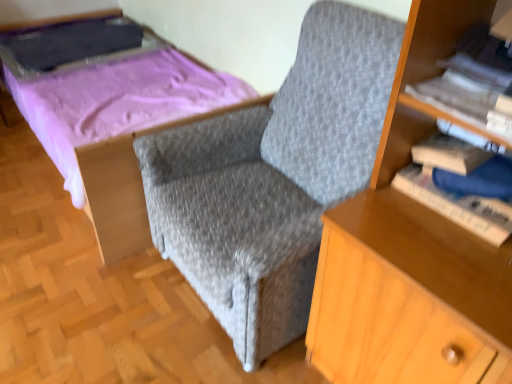
Question: Considering the relative sizes of matte purple bed at upper left and hardcover book at right, which ranks as the 2th book in top-to-bottom order, in the image provided, is matte purple bed at upper left shorter than hardcover book at right, which ranks as the 2th book in top-to-bottom order,?

Choices:
 (A) no
 (B) yes

Answer: (A)

Question: From the image's perspective, does matte purple bed at upper left appear higher than hardcover book at right, which ranks as the 2th book in top-to-bottom order?

Choices:
 (A) yes
 (B) no

Answer: (A)

Question: Is matte purple bed at upper left in front of hardcover book at right, which ranks as the 2th book in top-to-bottom order?

Choices:
 (A) no
 (B) yes

Answer: (A)

Question: Would you say matte purple bed at upper left is a long distance from hardcover book at right, which ranks as the first book in bottom-to-top order?

Choices:
 (A) no
 (B) yes

Answer: (B)

Question: Can you confirm if matte purple bed at upper left is positioned to the left of hardcover book at right, which ranks as the first book in bottom-to-top order?

Choices:
 (A) yes
 (B) no

Answer: (A)

Question: Could you tell me if matte purple bed at upper left is facing hardcover book at right, which ranks as the first book in bottom-to-top order?

Choices:
 (A) no
 (B) yes

Answer: (B)

Question: Considering the relative sizes of white paper book at upper right, the first book when ordered from top to bottom, and hardcover book at right, which ranks as the first book in bottom-to-top order, in the image provided, is white paper book at upper right, the first book when ordered from top to bottom, taller than hardcover book at right, which ranks as the first book in bottom-to-top order,?

Choices:
 (A) no
 (B) yes

Answer: (A)

Question: Is white paper book at upper right, placed as the 2th book when sorted from bottom to top, oriented away from hardcover book at right, which ranks as the 2th book in top-to-bottom order?

Choices:
 (A) no
 (B) yes

Answer: (A)

Question: Could you tell me if white paper book at upper right, the first book when ordered from top to bottom, is turned towards hardcover book at right, which ranks as the 2th book in top-to-bottom order?

Choices:
 (A) no
 (B) yes

Answer: (A)

Question: Considering the relative sizes of white paper book at upper right, placed as the 2th book when sorted from bottom to top, and hardcover book at right, which ranks as the first book in bottom-to-top order, in the image provided, is white paper book at upper right, placed as the 2th book when sorted from bottom to top, shorter than hardcover book at right, which ranks as the first book in bottom-to-top order,?

Choices:
 (A) no
 (B) yes

Answer: (B)

Question: From the image's perspective, does white paper book at upper right, placed as the 2th book when sorted from bottom to top, appear lower than hardcover book at right, which ranks as the 2th book in top-to-bottom order?

Choices:
 (A) no
 (B) yes

Answer: (A)

Question: Could hardcover book at right, which ranks as the first book in bottom-to-top order, be considered to be inside white paper book at upper right, the first book when ordered from top to bottom?

Choices:
 (A) no
 (B) yes

Answer: (A)

Question: Is matte purple bed at upper left next to white paper book at upper right, placed as the 2th book when sorted from bottom to top, and touching it?

Choices:
 (A) yes
 (B) no

Answer: (B)